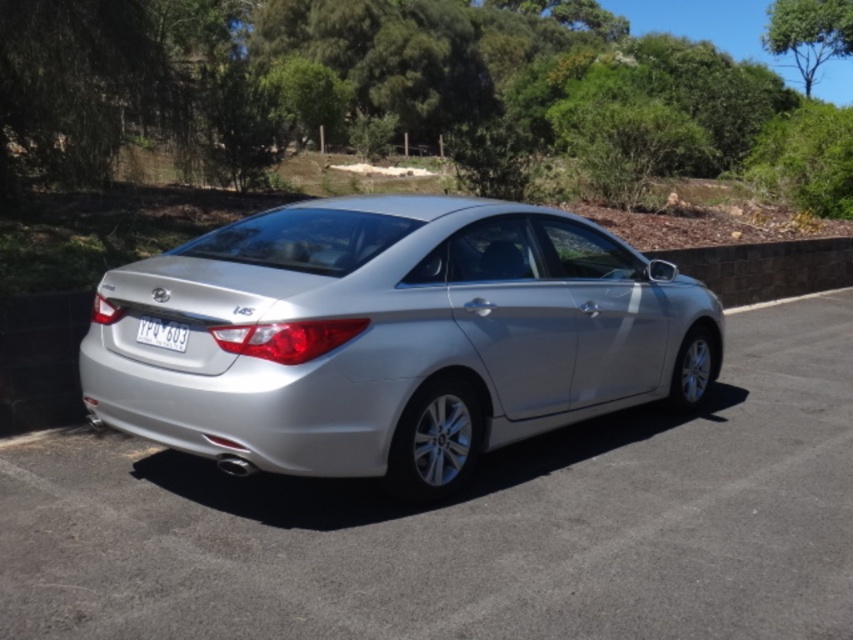
Does point (140, 608) come behind point (508, 346)?

No, (140, 608) is closer to viewer.

Does silver metallic car at center appear on the left side of silver metallic sedan at center?

In fact, silver metallic car at center is to the right of silver metallic sedan at center.

Which is behind, point (48, 513) or point (434, 260)?

Point (434, 260)

You are a GUI agent. You are given a task and a screenshot of the screen. Output one action in this format:
    pyautogui.click(x=<x>, y=<y>)
    Task: Click on the silver metallic car at center
    This screenshot has height=640, width=853.
    Given the screenshot: What is the action you would take?
    pyautogui.click(x=471, y=525)

Is silver metallic sedan at center to the right of white plastic license plate at center from the viewer's perspective?

Yes, silver metallic sedan at center is to the right of white plastic license plate at center.

Is point (561, 216) more distant than point (165, 326)?

Yes, point (561, 216) is behind point (165, 326).

I want to click on silver metallic sedan at center, so click(392, 337).

Does silver metallic car at center have a lesser width compared to white plastic license plate at center?

In fact, silver metallic car at center might be wider than white plastic license plate at center.

Can you confirm if silver metallic car at center is wider than white plastic license plate at center?

Yes, silver metallic car at center is wider than white plastic license plate at center.

Does point (759, 452) come farther from viewer compared to point (180, 337)?

Yes, it is behind point (180, 337).

Where is `silver metallic car at center`? silver metallic car at center is located at coordinates (471, 525).